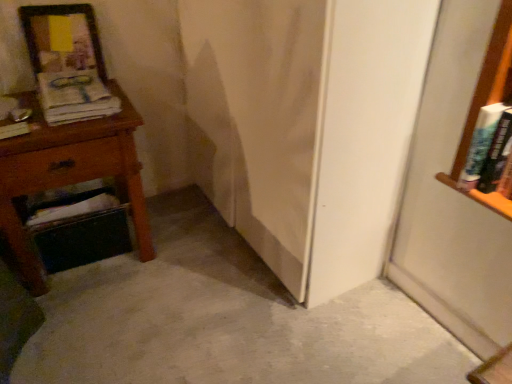
What do you see at coordinates (69, 174) in the screenshot? I see `wooden nightstand at left` at bounding box center [69, 174].

Identify the location of hardcover book at right, the 2th book from the left. (488, 148).

Describe the element at coordinates (14, 130) in the screenshot. I see `hardcover book at left, which ranks as the second book in right-to-left order` at that location.

What do you see at coordinates (72, 37) in the screenshot? I see `wooden picture frame at upper left` at bounding box center [72, 37].

Where is `wooden nightstand at left`? The height and width of the screenshot is (384, 512). wooden nightstand at left is located at coordinates (69, 174).

Can you confirm if hardcover book at right, the 1th book when ordered from right to left, is bigger than wooden nightstand at left?

Incorrect, hardcover book at right, the 1th book when ordered from right to left, is not larger than wooden nightstand at left.

From a real-world perspective, is hardcover book at right, the 1th book when ordered from right to left, located higher than wooden nightstand at left?

Yes.

Does point (466, 180) appear closer or farther from the camera than point (53, 148)?

Point (466, 180) appears to be closer to the viewer than point (53, 148).

Can you confirm if white glossy screen door at center is thinner than wooden nightstand at left?

Correct, the width of white glossy screen door at center is less than that of wooden nightstand at left.

Is white glossy screen door at center not inside wooden nightstand at left?

white glossy screen door at center is positioned outside wooden nightstand at left.

Which is more to the right, white glossy screen door at center or wooden nightstand at left?

white glossy screen door at center.

The image size is (512, 384). Find the location of `screen door above the wooden nightstand at left (from the image's perspective)`. screen door above the wooden nightstand at left (from the image's perspective) is located at coordinates (257, 119).

Can you confirm if wooden picture frame at upper left is bigger than white glossy screen door at center?

No.

Does wooden picture frame at upper left have a lesser height compared to white glossy screen door at center?

Yes.

From a real-world perspective, who is located lower, wooden picture frame at upper left or white glossy screen door at center?

white glossy screen door at center.

In the image, is matte paper magazine at left positioned in front of or behind white glossy screen door at center?

In the image, matte paper magazine at left appears behind white glossy screen door at center.

Which is less distant, (x=106, y=88) or (x=224, y=203)?

Point (x=106, y=88) is positioned closer to the camera compared to point (x=224, y=203).

Is white glossy screen door at center at the back of matte paper magazine at left?

No, matte paper magazine at left's orientation is not away from white glossy screen door at center.

From their relative heights in the image, would you say matte paper magazine at left is taller or shorter than white glossy screen door at center?

Clearly, matte paper magazine at left is shorter compared to white glossy screen door at center.

From the picture: Can you confirm if wooden nightstand at left is bigger than wooden picture frame at upper left?

Yes, wooden nightstand at left is bigger than wooden picture frame at upper left.

Is point (113, 174) positioned behind point (23, 22)?

No, (113, 174) is closer to viewer.

Between wooden nightstand at left and wooden picture frame at upper left, which one has more height?

With more height is wooden nightstand at left.

From the image's perspective, is wooden nightstand at left above wooden picture frame at upper left?

No, from the image's perspective, wooden nightstand at left is not above wooden picture frame at upper left.

From a real-world perspective, who is located lower, matte paper magazine at left or wooden nightstand at left?

From a 3D spatial view, wooden nightstand at left is below.

Is matte paper magazine at left positioned with its back to wooden nightstand at left?

No, wooden nightstand at left is not at the back of matte paper magazine at left.

What's the angular difference between matte paper magazine at left and wooden nightstand at left's facing directions?

The facing directions of matte paper magazine at left and wooden nightstand at left are 0.134 degrees apart.

From the image's perspective, is matte paper magazine at left located above or below wooden nightstand at left?

Clearly, from the image's perspective, matte paper magazine at left is above wooden nightstand at left.

Based on the photo, measure the distance from wooden nightstand at left to white glossy screen door at center.

They are 20.04 inches apart.

Would you say wooden nightstand at left contains white glossy screen door at center?

No, white glossy screen door at center is not surrounded by wooden nightstand at left.

From a real-world perspective, is wooden nightstand at left positioned above or below white glossy screen door at center?

Clearly, from a real-world perspective, wooden nightstand at left is below white glossy screen door at center.

What's the angular difference between wooden nightstand at left and white glossy screen door at center's facing directions?

wooden nightstand at left and white glossy screen door at center are facing 86.6 degrees away from each other.

Find the location of a particular element. The width and height of the screenshot is (512, 384). nightstand located below the hardcover book at right, the 1th book when ordered from right to left (from the image's perspective) is located at coordinates (69, 174).

The image size is (512, 384). I want to click on screen door in front of the wooden nightstand at left, so click(x=257, y=119).

Estimate the real-world distances between objects in this image. Which object is closer to matte paper magazine at left, wooden picture frame at upper left or white glossy screen door at center?

wooden picture frame at upper left.

In the scene shown: From the image, which object appears to be farther from matte paper magazine at left, hardcover book at right, the 1th book when ordered from right to left, or wooden picture frame at upper left?

hardcover book at right, the 1th book when ordered from right to left, is positioned further to the anchor matte paper magazine at left.

Which object lies further to the anchor point hardcover book at left, which ranks as the second book in right-to-left order, white glossy screen door at center or hardcover book at right, the 2th book from the left?

hardcover book at right, the 2th book from the left.

Based on their spatial positions, is hardcover book at left, placed as the first book when sorted from left to right, or white glossy screen door at center further from wooden picture frame at upper left?

white glossy screen door at center.

From the image, which object appears to be nearer to wooden nightstand at left, hardcover book at left, which ranks as the second book in right-to-left order, or hardcover book at right, the 2th book from the left?

hardcover book at left, which ranks as the second book in right-to-left order.

Considering their positions, is hardcover book at left, which ranks as the second book in right-to-left order, positioned closer to matte paper magazine at left than hardcover book at right, the 1th book when ordered from right to left?

hardcover book at left, which ranks as the second book in right-to-left order, is closer to matte paper magazine at left.

Considering their positions, is matte paper magazine at left positioned further to white glossy screen door at center than wooden picture frame at upper left?

wooden picture frame at upper left is positioned further to the anchor white glossy screen door at center.

Based on their spatial positions, is wooden picture frame at upper left or hardcover book at left, which ranks as the second book in right-to-left order, further from hardcover book at right, the 1th book when ordered from right to left?

Among the two, wooden picture frame at upper left is located further to hardcover book at right, the 1th book when ordered from right to left.

Identify the location of nightstand between hardcover book at left, which ranks as the second book in right-to-left order, and hardcover book at right, the 1th book when ordered from right to left, in the horizontal direction. This screenshot has height=384, width=512. (69, 174).

At what (x,y) coordinates should I click in order to perform the action: click on screen door situated between hardcover book at left, placed as the first book when sorted from left to right, and hardcover book at right, the 1th book when ordered from right to left, from left to right. Please return your answer as a coordinate pair (x, y). Looking at the image, I should click on (257, 119).

Locate an element on the screen. This screenshot has height=384, width=512. picture frame between wooden nightstand at left and white glossy screen door at center in the horizontal direction is located at coordinates (72, 37).

I want to click on magazine between wooden nightstand at left and white glossy screen door at center, so click(x=75, y=97).